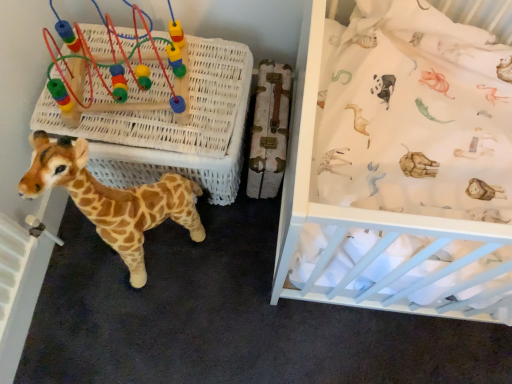
In order to click on vacant space situated on the left part of soft plush giraffe at lower left in this screenshot , I will do `click(68, 268)`.